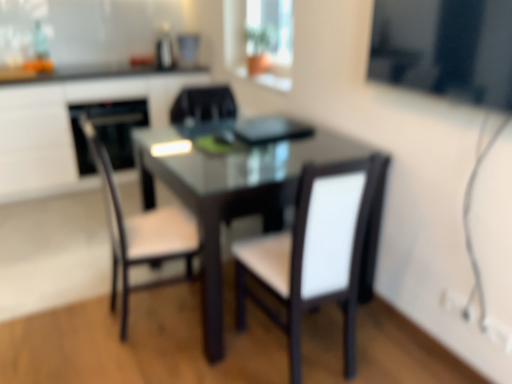
Where is `free spot in front of white matte chair at center, which is the 1th chair in left-to-right order`? free spot in front of white matte chair at center, which is the 1th chair in left-to-right order is located at coordinates click(142, 360).